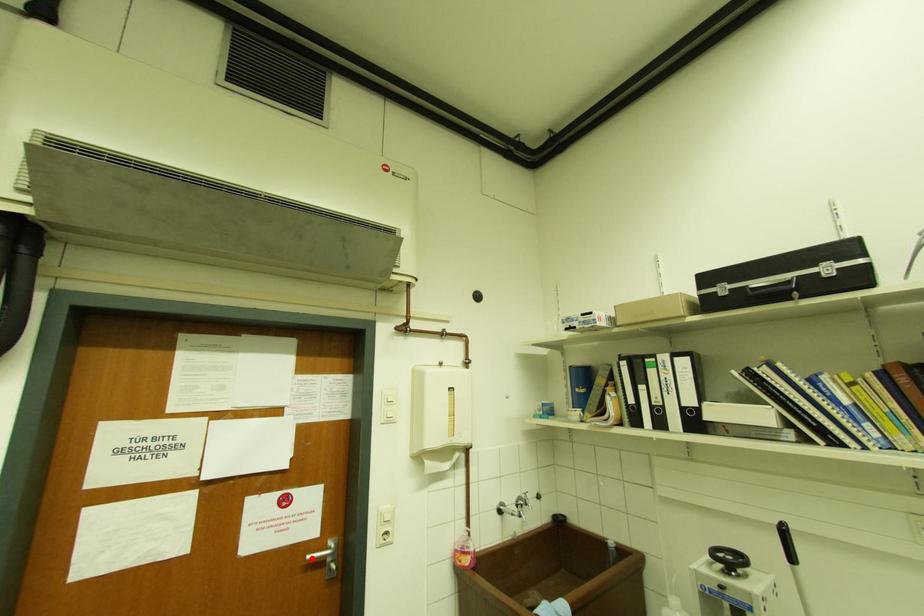
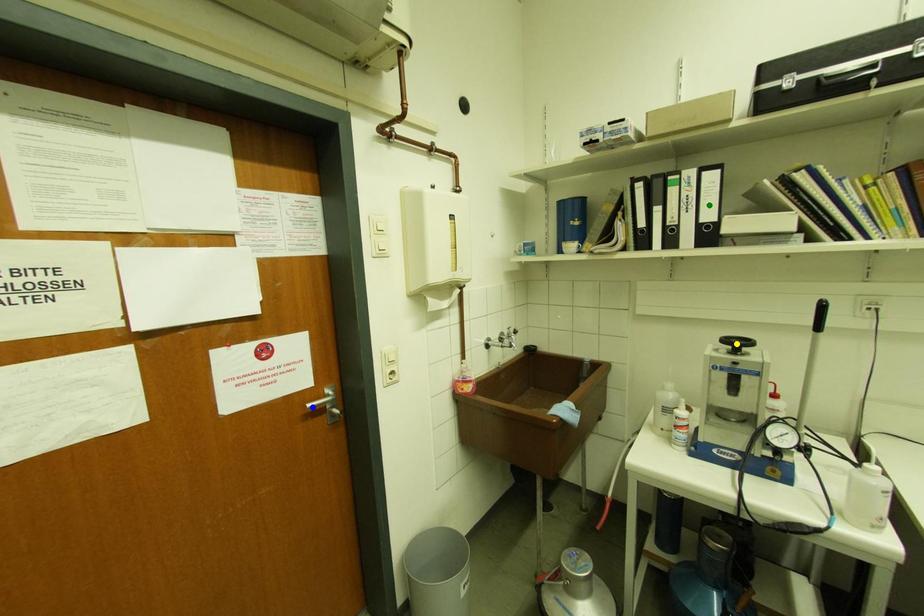
Question: I am providing you with two images of the same scene from different viewpoints. A red point is marked on the first image. You are given multiple points on the second image. Which spot in image 2 lines up with the point in image 1?

Choices:
 (A) blue point
 (B) green point
 (C) yellow point

Answer: (A)